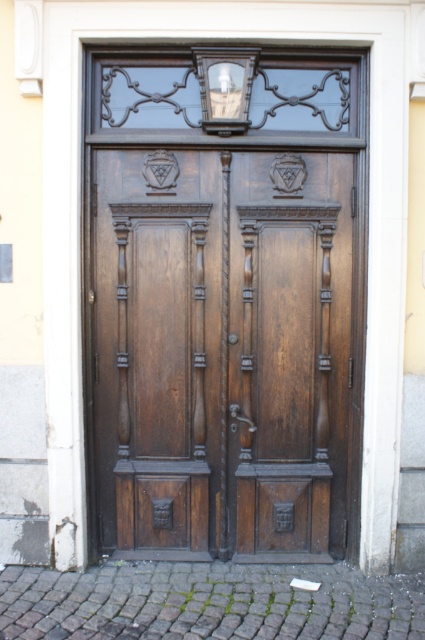
You are a delivery person trying to deliver a package to the address. The package is too large to fit through the door, so you need to check the distance between the polished wood door at center and the matte glass lamp at upper center to see if you can slide it through. Can you determine if the distance is sufficient?

The distance between the polished wood door at center and the matte glass lamp at upper center is 22.25 inches. If the package is wider than this measurement, it won t fit through the space. You should measure the package s width and compare it to 22.25 inches to determine if it can pass through.

You are standing in front of the ornate wooden door and want to determine the relative positions of two points marked on it. The first point is at coordinates point (329, 353) and the second is at point (215, 99). Which point is closer to you?

Point (329, 353) is further to the viewer than point (215, 99), so the point closer to you is point (215, 99).

You are standing in front of the ornate wooden door and need to locate the polished wood door at center. Where exactly is it positioned in terms of coordinates?

The polished wood door at center is positioned at coordinates point [224,307].